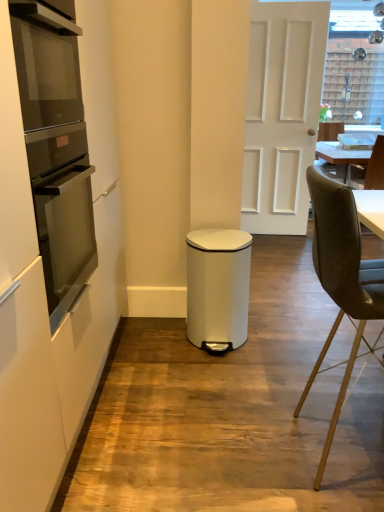
Question: Is white matte waste bin at center placed right next to black leather chair at right, acting as the second chair starting from the front?

Choices:
 (A) yes
 (B) no

Answer: (B)

Question: Is black leather chair at right, which is counted as the second chair, starting from the bottom, at the back of white matte waste bin at center?

Choices:
 (A) yes
 (B) no

Answer: (B)

Question: Does white matte waste bin at center have a lesser height compared to black leather chair at right, the first chair in the back-to-front sequence?

Choices:
 (A) yes
 (B) no

Answer: (A)

Question: Does white matte waste bin at center have a lesser width compared to black leather chair at right, the second chair when ordered from left to right?

Choices:
 (A) yes
 (B) no

Answer: (A)

Question: From a real-world perspective, is white matte waste bin at center under black leather chair at right, the 1th chair positioned from the top?

Choices:
 (A) yes
 (B) no

Answer: (A)

Question: Considering their positions, is white matte door at center located in front of or behind matte black oven at left?

Choices:
 (A) behind
 (B) front

Answer: (A)

Question: Based on their sizes in the image, would you say white matte door at center is bigger or smaller than matte black oven at left?

Choices:
 (A) small
 (B) big

Answer: (B)

Question: Considering the positions of white matte door at center and matte black oven at left in the image, is white matte door at center taller or shorter than matte black oven at left?

Choices:
 (A) short
 (B) tall

Answer: (B)

Question: Is white matte door at center inside the boundaries of matte black oven at left, or outside?

Choices:
 (A) outside
 (B) inside

Answer: (A)

Question: Considering the positions of white matte cabinet at left and black leather chair at right, acting as the second chair starting from the front, in the image, is white matte cabinet at left bigger or smaller than black leather chair at right, acting as the second chair starting from the front,?

Choices:
 (A) small
 (B) big

Answer: (B)

Question: From the image's perspective, is white matte cabinet at left positioned above or below black leather chair at right, the first chair in the back-to-front sequence?

Choices:
 (A) above
 (B) below

Answer: (B)

Question: Which is correct: white matte cabinet at left is inside black leather chair at right, acting as the second chair starting from the front, or outside of it?

Choices:
 (A) inside
 (B) outside

Answer: (B)

Question: Considering the positions of point (92, 387) and point (350, 167), is point (92, 387) closer or farther from the camera than point (350, 167)?

Choices:
 (A) farther
 (B) closer

Answer: (B)

Question: Is black leather chair at right, acting as the second chair starting from the front, in front of or behind white matte waste bin at center in the image?

Choices:
 (A) front
 (B) behind

Answer: (B)

Question: Considering the relative positions of black leather chair at right, positioned as the 1th chair in right-to-left order, and white matte waste bin at center in the image provided, is black leather chair at right, positioned as the 1th chair in right-to-left order, to the left or to the right of white matte waste bin at center?

Choices:
 (A) left
 (B) right

Answer: (B)